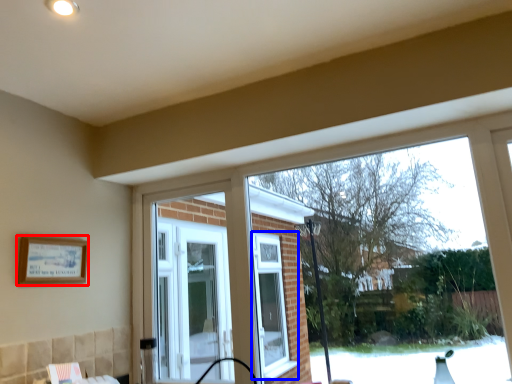
Question: Which object is closer to the camera taking this photo, picture frame (highlighted by a red box) or window (highlighted by a blue box)?

Choices:
 (A) picture frame
 (B) window

Answer: (A)